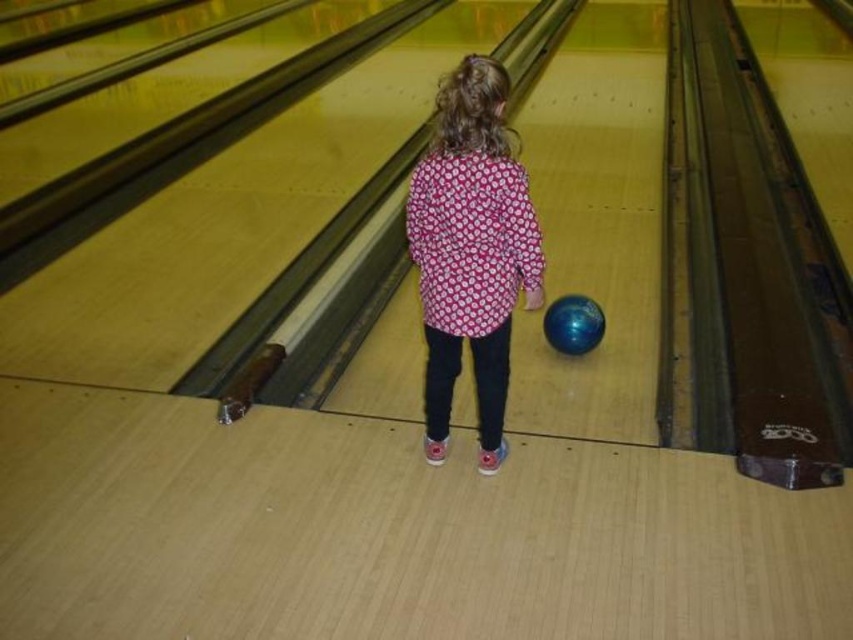
Question: Among these objects, which one is nearest to the camera?

Choices:
 (A) pink dotted shirt at center
 (B) blue glossy bowling ball at center

Answer: (A)

Question: Can you confirm if pink dotted shirt at center is wider than blue glossy bowling ball at center?

Choices:
 (A) yes
 (B) no

Answer: (A)

Question: Which point appears closest to the camera in this image?

Choices:
 (A) (520, 264)
 (B) (590, 307)

Answer: (A)

Question: Which object is farther from the camera taking this photo?

Choices:
 (A) blue glossy bowling ball at center
 (B) pink dotted shirt at center

Answer: (A)

Question: Considering the relative positions of pink dotted shirt at center and blue glossy bowling ball at center in the image provided, where is pink dotted shirt at center located with respect to blue glossy bowling ball at center?

Choices:
 (A) left
 (B) right

Answer: (A)

Question: Where is pink dotted shirt at center located in relation to blue glossy bowling ball at center in the image?

Choices:
 (A) right
 (B) left

Answer: (B)